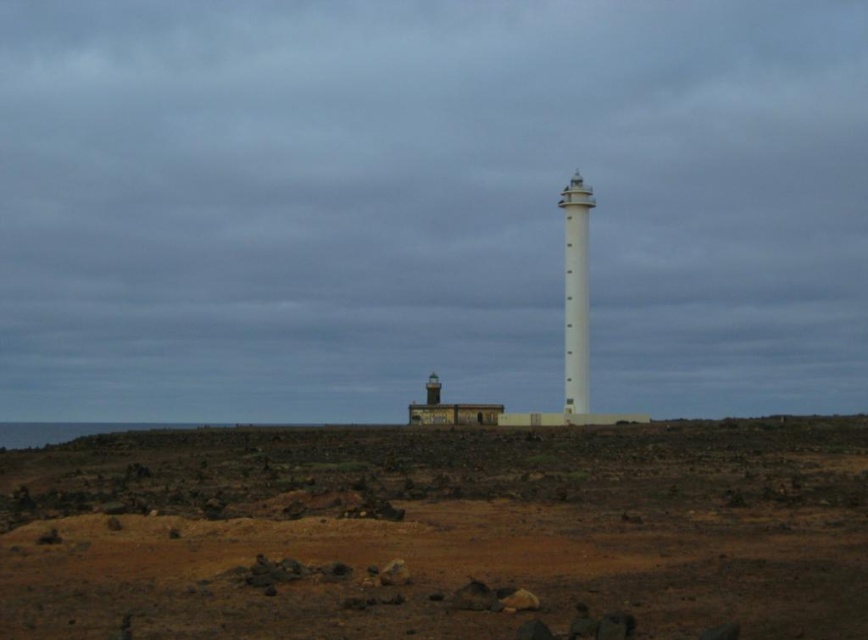
Which of these two, brown dirt at lower center or white smooth tower at center, stands taller?

white smooth tower at center is taller.

Locate an element on the screen. Image resolution: width=868 pixels, height=640 pixels. brown dirt at lower center is located at coordinates (438, 531).